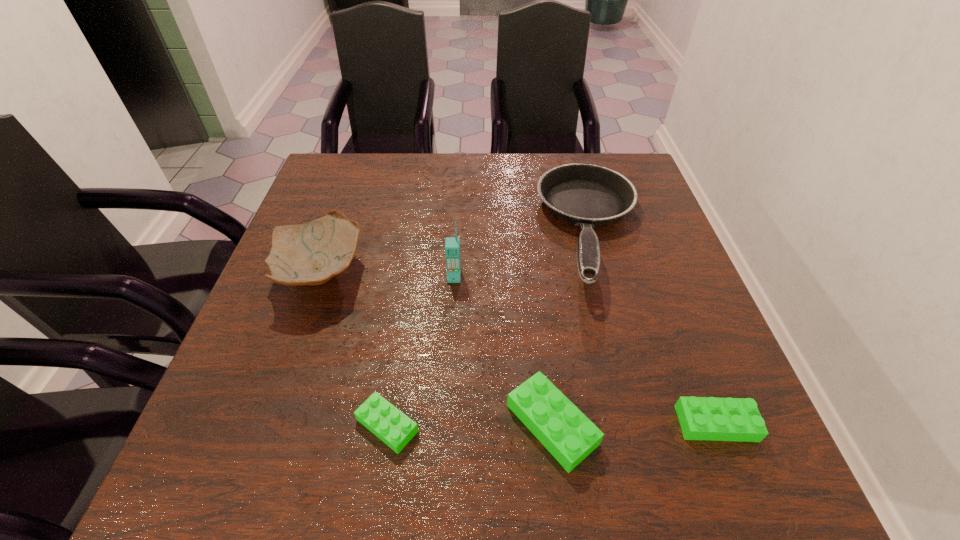
Identify the location of empty space between the frying pan and the second object from left to right. This screenshot has width=960, height=540. (490, 328).

You are a GUI agent. You are given a task and a screenshot of the screen. Output one action in this format:
    pyautogui.click(x=<x>, y=<y>)
    Task: Click on the free space that is in between the third tallest object and the fifth object from right to left
    This screenshot has width=960, height=540.
    Given the screenshot: What is the action you would take?
    pyautogui.click(x=490, y=328)

At what (x,y) coordinates should I click in order to perform the action: click on vacant region between the cellular telephone and the fifth object from right to left. Please return your answer as a coordinate pair (x, y). The width and height of the screenshot is (960, 540). Looking at the image, I should click on (x=420, y=351).

The image size is (960, 540). Find the location of `vacant region between the frying pan and the tallest Lego`. vacant region between the frying pan and the tallest Lego is located at coordinates (572, 327).

At what (x,y) coordinates should I click in order to perform the action: click on vacant area that lies between the fifth shortest object and the shortest object. Please return your answer as a coordinate pair (x, y). Looking at the image, I should click on (353, 349).

Identify the location of vacant area that lies between the shortest Lego and the tallest object. (420, 351).

This screenshot has height=540, width=960. I want to click on unoccupied area between the tallest object and the shortest Lego, so click(x=420, y=351).

Identify which object is located as the nearest to the fourth tallest object. Please provide its 2D coordinates. Your answer should be formatted as a tuple, i.e. [(x, y)], where the tuple contains the x and y coordinates of a point satisfying the conditions above.

[(701, 418)]

Identify which object is the closest to the third object from left to right. Please provide its 2D coordinates. Your answer should be formatted as a tuple, i.e. [(x, y)], where the tuple contains the x and y coordinates of a point satisfying the conditions above.

[(587, 195)]

Select which Lego is the closest to the second shortest Lego. Please provide its 2D coordinates. Your answer should be formatted as a tuple, i.e. [(x, y)], where the tuple contains the x and y coordinates of a point satisfying the conditions above.

[(554, 420)]